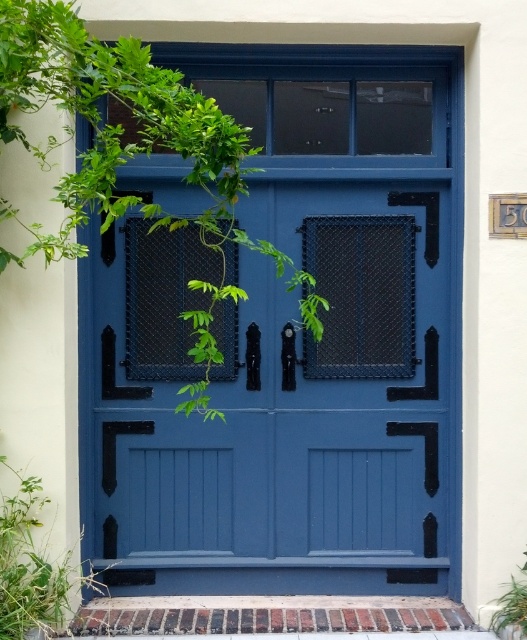
Question: Which of these objects is positioned closest to the green leafy plant at center?

Choices:
 (A) green leafy plant at lower left
 (B) matte blue door at center

Answer: (B)

Question: Does matte blue door at center appear over green leafy plant at center?

Choices:
 (A) no
 (B) yes

Answer: (B)

Question: Is the position of green leafy plant at lower left more distant than that of green leafy plant at center?

Choices:
 (A) no
 (B) yes

Answer: (A)

Question: In this image, where is matte blue door at center located relative to green leafy plant at lower left?

Choices:
 (A) right
 (B) left

Answer: (A)

Question: Which point is closer to the camera taking this photo?

Choices:
 (A) (6, 582)
 (B) (493, 621)

Answer: (A)

Question: Which of these objects is positioned farthest from the green leafy plant at lower left?

Choices:
 (A) matte blue door at center
 (B) green leafy plant at center

Answer: (B)